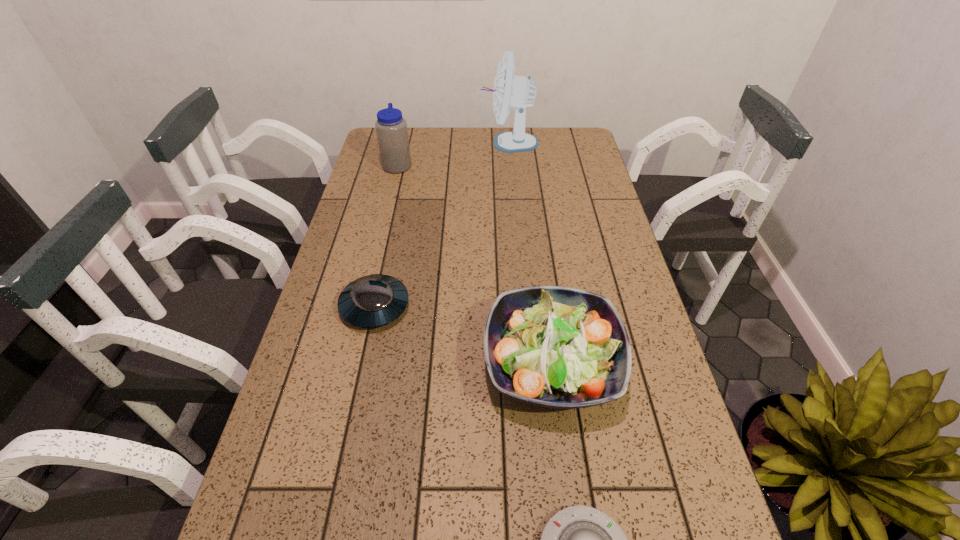
Where is `object that is the third closest one to the shortest object`? The image size is (960, 540). object that is the third closest one to the shortest object is located at coordinates (391, 128).

Identify the location of the second closest object to the tallest object. (371, 301).

Locate an element on the screen. This screenshot has width=960, height=540. vacant space that satisfies the following two spatial constraints: 1. with a carrying loop on the side of the salad plate; 2. on the left side of the water bottle is located at coordinates (350, 363).

The height and width of the screenshot is (540, 960). I want to click on vacant area in the image that satisfies the following two spatial constraints: 1. with a carrying loop on the side of the second tallest object; 2. on the back side of the third tallest object, so click(350, 363).

The width and height of the screenshot is (960, 540). In order to click on vacant position in the image that satisfies the following two spatial constraints: 1. on the back side of the third shortest object; 2. with a carrying loop on the side of the water bottle in this screenshot , I will do `click(525, 165)`.

Locate an element on the screen. The height and width of the screenshot is (540, 960). free spot that satisfies the following two spatial constraints: 1. on the grille of the fan; 2. on the front side of the farther saucer is located at coordinates (521, 306).